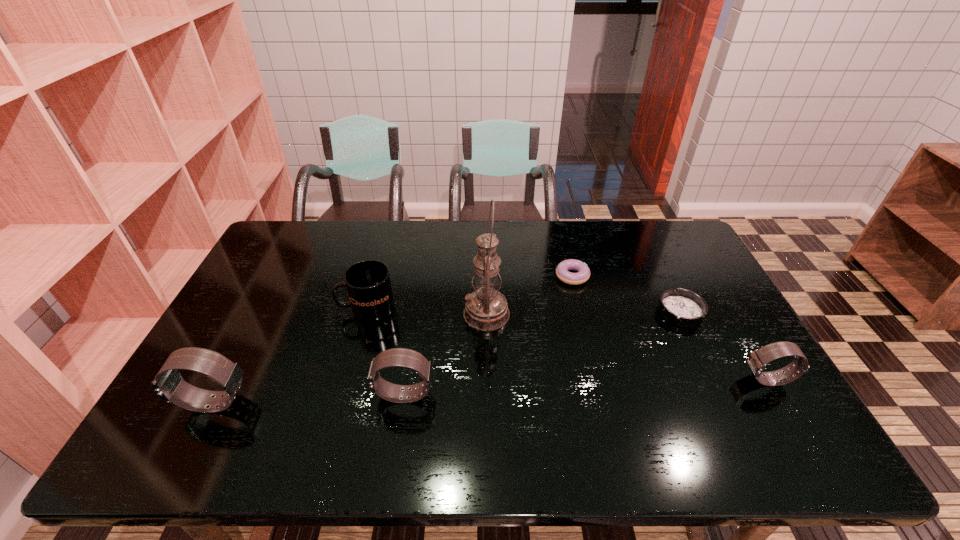
This screenshot has width=960, height=540. What are the coordinates of `the leftmost object` in the screenshot? It's located at (169, 385).

This screenshot has width=960, height=540. I want to click on the second tallest watch, so [x=402, y=357].

The image size is (960, 540). What are the coordinates of `the rightmost object` in the screenshot? It's located at (757, 361).

Identify the location of the shortest watch. (757, 361).

Identify the location of doughnut. The height and width of the screenshot is (540, 960). (562, 271).

Locate an element on the screen. This screenshot has width=960, height=540. the farthest object is located at coordinates (562, 271).

At what (x,y) coordinates should I click in order to perform the action: click on the fourth object from right to left. Please return your answer as a coordinate pair (x, y). This screenshot has height=540, width=960. Looking at the image, I should click on (486, 309).

Identify the location of the tallest object. (486, 309).

This screenshot has width=960, height=540. I want to click on mug, so click(x=368, y=283).

Where is `ashtray`? The image size is (960, 540). ashtray is located at coordinates (682, 307).